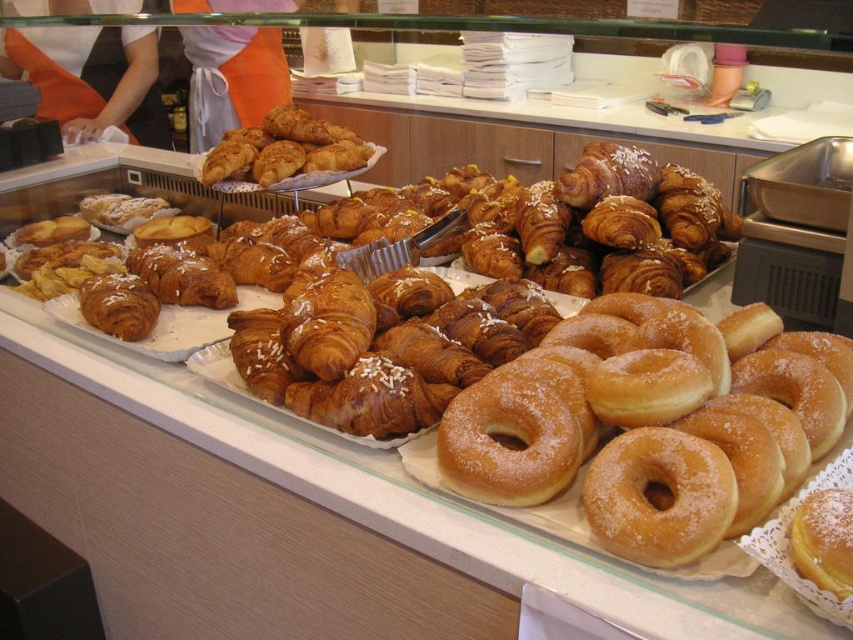
The image size is (853, 640). Identify the location of glossy sugar-coated donut at center. click(650, 426).

Between glossy sugar-coated donut at center and golden brown croissant at center, which one appears on the right side from the viewer's perspective?

From the viewer's perspective, glossy sugar-coated donut at center appears more on the right side.

This screenshot has width=853, height=640. I want to click on glossy sugar-coated donut at center, so click(x=650, y=426).